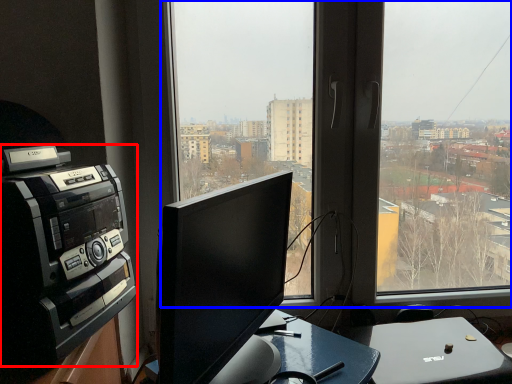
Question: Which object appears closest to the camera in this image, amplifier (highlighted by a red box) or window (highlighted by a blue box)?

Choices:
 (A) amplifier
 (B) window

Answer: (A)